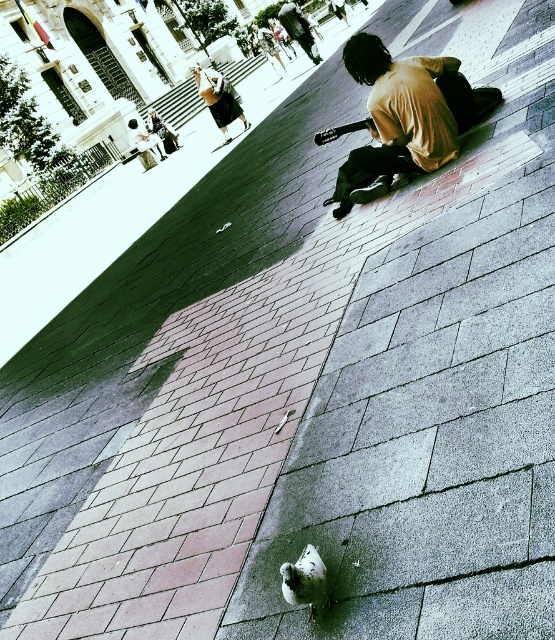
Can you confirm if white matte pigeon at lower center is bigger than matte yellow shirt at upper center?

Incorrect, white matte pigeon at lower center is not larger than matte yellow shirt at upper center.

Is point (290, 582) behind point (215, 90)?

No, (290, 582) is in front of (215, 90).

This screenshot has width=555, height=640. What do you see at coordinates (305, 580) in the screenshot?
I see `white matte pigeon at lower center` at bounding box center [305, 580].

The image size is (555, 640). Identify the location of white matte pigeon at lower center. (305, 580).

Is light brown cotton shirt at lower right to the right of matte yellow shirt at upper center from the viewer's perspective?

Yes, light brown cotton shirt at lower right is to the right of matte yellow shirt at upper center.

Is light brown cotton shirt at lower right positioned before matte yellow shirt at upper center?

Yes.

Describe the element at coordinates (405, 115) in the screenshot. This screenshot has height=640, width=555. I see `light brown cotton shirt at lower right` at that location.

Identify the location of light brown cotton shirt at lower right. The height and width of the screenshot is (640, 555). (405, 115).

Who is positioned more to the right, white matte pigeon at lower center or brown leather jacket at upper center?

Positioned to the right is white matte pigeon at lower center.

Between point (311, 611) and point (309, 51), which one is positioned behind?

Point (309, 51)

This screenshot has height=640, width=555. In order to click on white matte pigeon at lower center in this screenshot , I will do `click(305, 580)`.